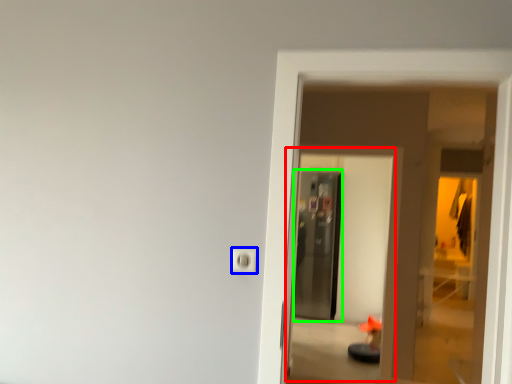
Question: Which object is positioned farthest from screen door (highlighted by a red box)? Select from electric outlet (highlighted by a blue box) and screen door (highlighted by a green box).

Choices:
 (A) electric outlet
 (B) screen door

Answer: (A)